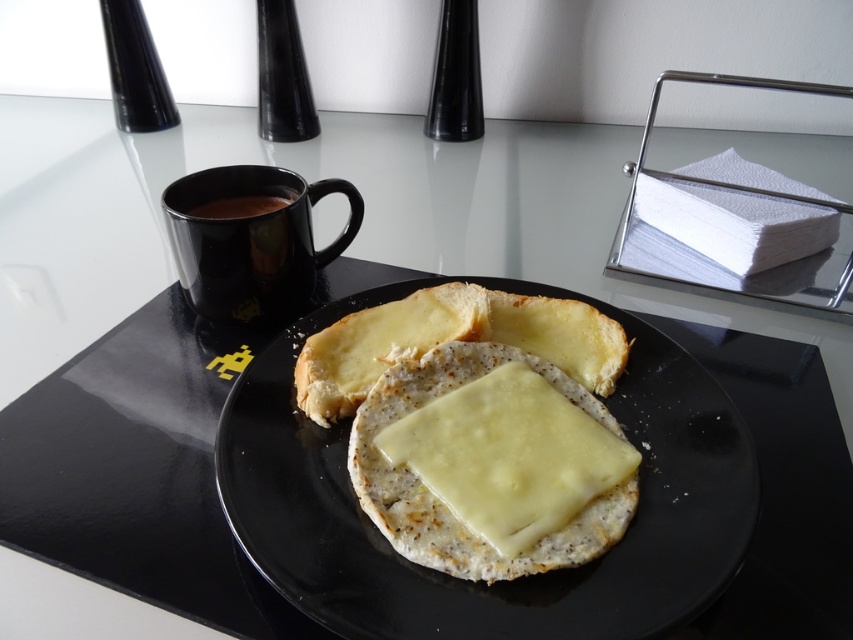
Does black matte mug at left have a greater width compared to black glossy mug at upper left?

Indeed, black matte mug at left has a greater width compared to black glossy mug at upper left.

Between black matte mug at left and black glossy mug at upper left, which one is positioned higher?

Positioned higher is black glossy mug at upper left.

Which is in front, point (196, 186) or point (196, 214)?

Point (196, 186) is more forward.

Locate an element on the screen. The image size is (853, 640). black matte mug at left is located at coordinates (250, 241).

Does point (425, 454) lie behind point (235, 216)?

No, it is not.

Does yellowish matte cheese at center appear on the right side of black glossy mug at upper left?

Indeed, yellowish matte cheese at center is positioned on the right side of black glossy mug at upper left.

This screenshot has height=640, width=853. Find the location of `yellowish matte cheese at center`. yellowish matte cheese at center is located at coordinates (508, 458).

Which is more to the right, yellowish matte cheese at center or black matte mug at left?

From the viewer's perspective, yellowish matte cheese at center appears more on the right side.

Is point (465, 449) positioned behind point (271, 192)?

No, (465, 449) is in front of (271, 192).

Identify the location of yellowish matte cheese at center. (508, 458).